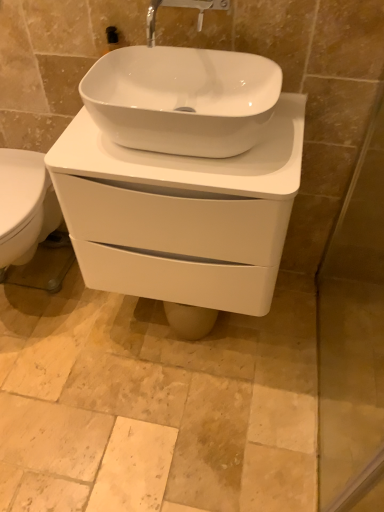
Find the location of a particular element. This screenshot has width=384, height=512. vacant space underneath transparent glass screen door at right (from a real-world perspective) is located at coordinates (331, 383).